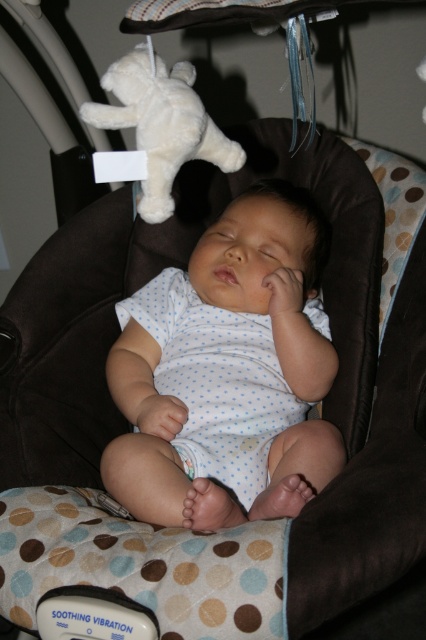
You are a parent looking at the baby in the swing. You notice the white dotted onesie at center and the white plush bear at upper left. Which object is taller?

The white dotted onesie at center is taller than the white plush bear at upper left.

You are a photographer taking a picture of the baby in the swing. You notice two points marked on the image. Which point is closer to the camera? The points are labeled as point (196,259) and point (195,93).

Point (195,93) is closer to the camera because the Objects Description states that point (196,259) is further away from the camera than point (195,93).

From the picture: You are a parent looking at your baby in the swing. You notice a white plush bear at upper left and a white dotted onesie at center. Which item is positioned to the right of the other?

The white dotted onesie at center is to the right of the white plush bear at upper left.